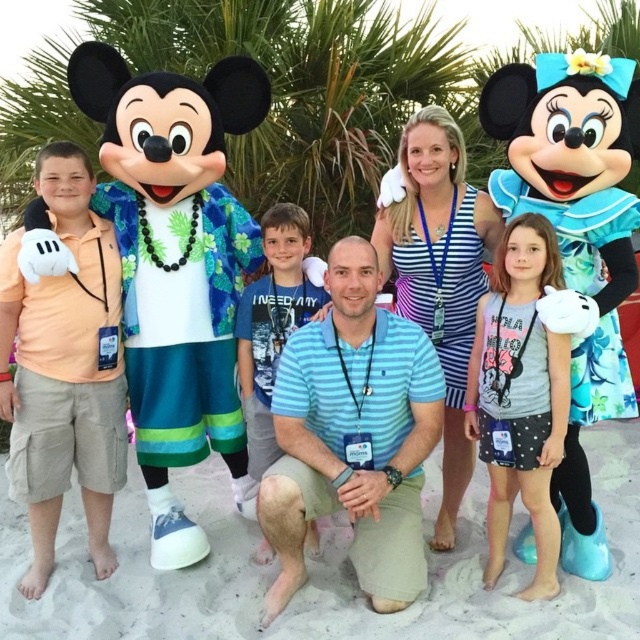
From the picture: You are a photographer trying to capture a closeup of the beige sand at center. You notice the white dotted fabric dress at lower right is blocking your view. Based on their positions, can you move the dress to the side to get a clear shot of the sand?

The beige sand at center is below the white dotted fabric dress at lower right, so moving the dress to the side would allow you to see the sand beneath it.

You are a photographer setting up for a family photo. You have a beige sand at center and a blue cotton shirt at center in your frame. Which object in your viewfinder has a bigger size?

The beige sand at center has a larger size compared to the blue cotton shirt at center.